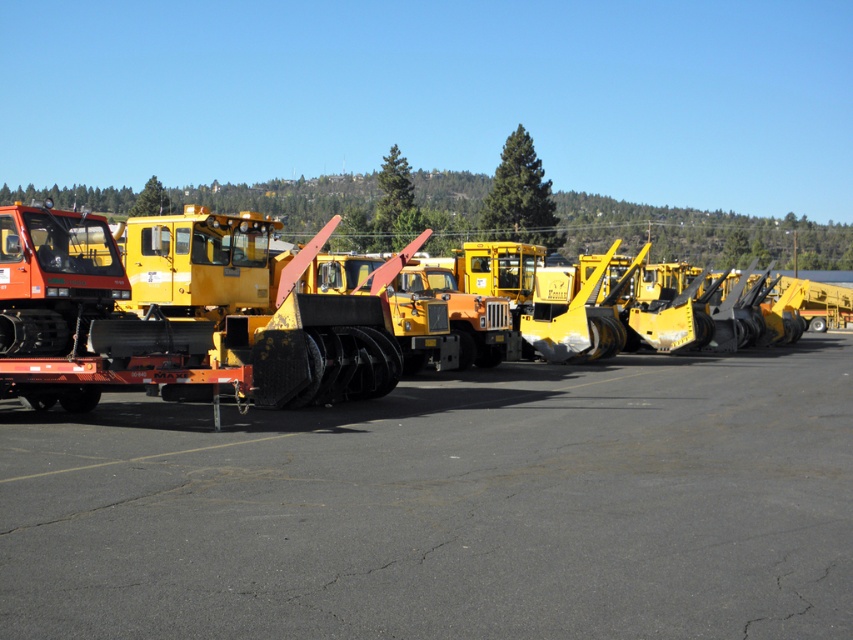
Question: Which of the following is the closest to the observer?

Choices:
 (A) (250, 355)
 (B) (727, 449)

Answer: (B)

Question: Does black asphalt at center have a greater width compared to matte black snowplow at left?

Choices:
 (A) yes
 (B) no

Answer: (A)

Question: Which point appears closest to the camera in this image?

Choices:
 (A) (766, 396)
 (B) (190, 224)

Answer: (B)

Question: Does black asphalt at center appear under matte black snowplow at left?

Choices:
 (A) yes
 (B) no

Answer: (A)

Question: Is the position of black asphalt at center more distant than that of matte black snowplow at left?

Choices:
 (A) no
 (B) yes

Answer: (A)

Question: Which of the following is the farthest from the observer?

Choices:
 (A) matte black snowplow at left
 (B) black asphalt at center

Answer: (A)